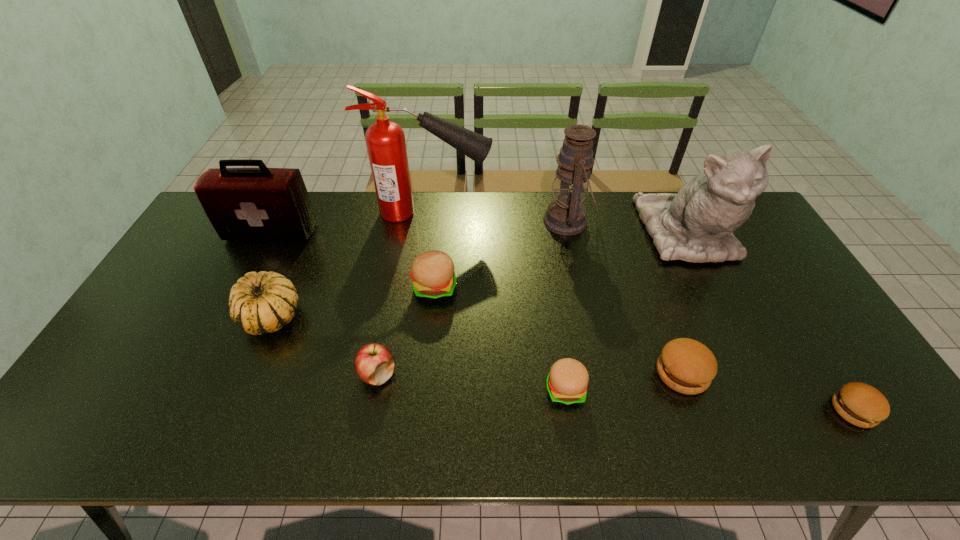
Locate an element on the screen. the bigger brown hamburger is located at coordinates (687, 366).

Image resolution: width=960 pixels, height=540 pixels. In order to click on the third hamburger from left to right in this screenshot , I will do `click(687, 366)`.

Where is `the smaller beige hamburger`? the smaller beige hamburger is located at coordinates (567, 381).

The image size is (960, 540). What are the coordinates of `the right beige hamburger` in the screenshot? It's located at (567, 381).

The height and width of the screenshot is (540, 960). I want to click on the rightmost hamburger, so click(x=860, y=404).

Find the location of `the shortest hamburger`. the shortest hamburger is located at coordinates (860, 404).

Locate an element on the screen. blank space located at the nozzle of the fire extinguisher is located at coordinates (605, 213).

Image resolution: width=960 pixels, height=540 pixels. Identify the location of free region located 0.060m on the front-facing side of the cat. (715, 292).

This screenshot has width=960, height=540. I want to click on blank space located on the left of the blue oil lamp, so click(x=503, y=221).

Where is `vacant region located 0.300m on the side of the red first aid kit with the cross symbol`? The image size is (960, 540). vacant region located 0.300m on the side of the red first aid kit with the cross symbol is located at coordinates coord(228,316).